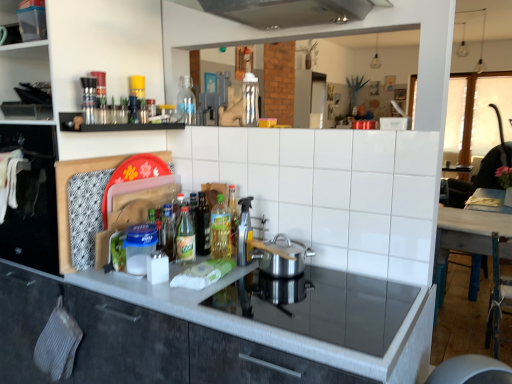
Question: Can you confirm if translucent glass bottle at center, which ranks as the fourth bottle in right-to-left order, is smaller than clear glass bottle at center, the 2th bottle viewed from the left?

Choices:
 (A) no
 (B) yes

Answer: (B)

Question: Can you confirm if translucent glass bottle at center, which is the 3th bottle in bottom-to-top order, is bigger than clear glass bottle at center, which ranks as the 4th bottle in front-to-back order?

Choices:
 (A) yes
 (B) no

Answer: (B)

Question: Can you confirm if translucent glass bottle at center, acting as the 2th bottle starting from the back, is positioned to the right of clear glass bottle at center, placed as the first bottle when sorted from back to front?

Choices:
 (A) yes
 (B) no

Answer: (B)

Question: Is translucent glass bottle at center, which is the 3th bottle in bottom-to-top order, wider than clear glass bottle at center, the 2th bottle viewed from the left?

Choices:
 (A) no
 (B) yes

Answer: (A)

Question: Is translucent glass bottle at center, which is the 3th bottle in bottom-to-top order, shorter than clear glass bottle at center, placed as the first bottle when sorted from back to front?

Choices:
 (A) no
 (B) yes

Answer: (B)

Question: From a real-world perspective, is transparent plastic container at upper left, the second shelf from the bottom, physically located above or below translucent glass bottle at center, which is the 3th bottle in bottom-to-top order?

Choices:
 (A) above
 (B) below

Answer: (A)

Question: Considering the positions of transparent plastic container at upper left, which is the first shelf in left-to-right order, and translucent glass bottle at center, acting as the 2th bottle starting from the back, in the image, is transparent plastic container at upper left, which is the first shelf in left-to-right order, bigger or smaller than translucent glass bottle at center, acting as the 2th bottle starting from the back,?

Choices:
 (A) small
 (B) big

Answer: (B)

Question: Does point (42, 9) appear closer or farther from the camera than point (169, 258)?

Choices:
 (A) closer
 (B) farther

Answer: (A)

Question: In the image, is transparent plastic container at upper left, which is the first shelf in left-to-right order, positioned in front of or behind translucent glass bottle at center, which ranks as the fourth bottle in right-to-left order?

Choices:
 (A) front
 (B) behind

Answer: (A)

Question: From the image's perspective, is polished stainless steel pot at center located above or below clear plastic spray bottle at center?

Choices:
 (A) above
 (B) below

Answer: (B)

Question: From a real-world perspective, is polished stainless steel pot at center above or below clear plastic spray bottle at center?

Choices:
 (A) below
 (B) above

Answer: (A)

Question: Based on their sizes in the image, would you say polished stainless steel pot at center is bigger or smaller than clear plastic spray bottle at center?

Choices:
 (A) big
 (B) small

Answer: (A)

Question: Is point (291, 244) positioned closer to the camera than point (239, 226)?

Choices:
 (A) farther
 (B) closer

Answer: (B)

Question: Does point (248, 226) appear closer or farther from the camera than point (110, 370)?

Choices:
 (A) closer
 (B) farther

Answer: (B)

Question: Relative to matte gray cabinetry at center, is clear plastic spray bottle at center in front or behind?

Choices:
 (A) behind
 (B) front

Answer: (A)